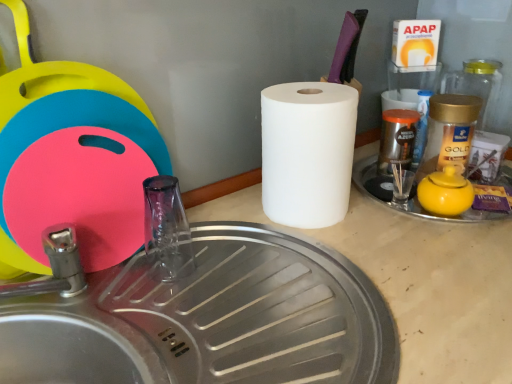
You are a GUI agent. You are given a task and a screenshot of the screen. Output one action in this format:
    pyautogui.click(x=<x>, y=<y>)
    Task: Click on the free space to the back side of transparent glass faucet at center
    The image size is (512, 384).
    Given the screenshot: What is the action you would take?
    pyautogui.click(x=205, y=231)